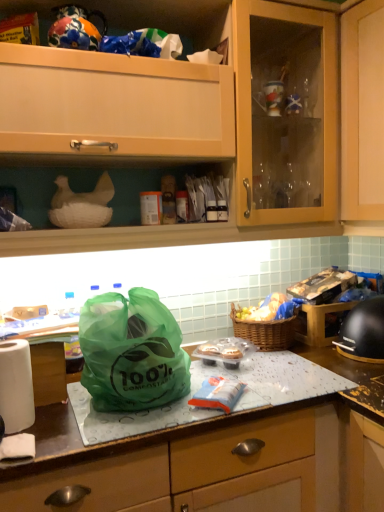
Find the location of a particular element. vacant space that is to the left of black matte helmet at right is located at coordinates (317, 362).